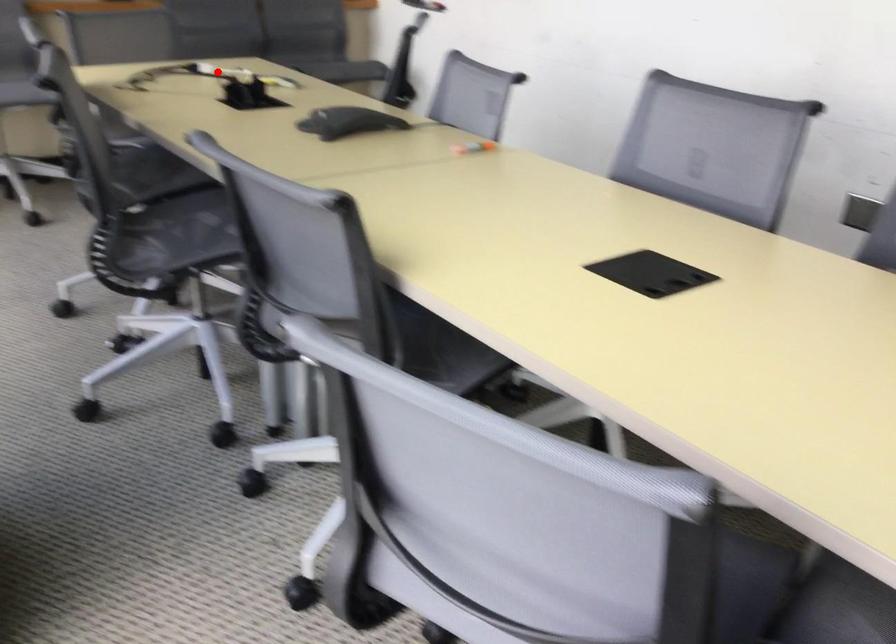
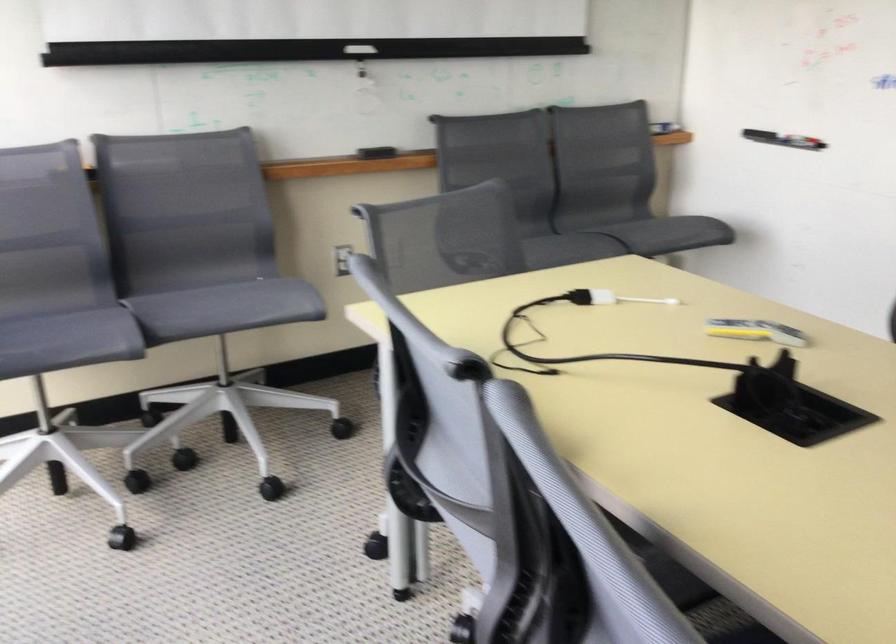
In the second image, find the point that corresponds to the highlighted location in the first image.

(610, 298)